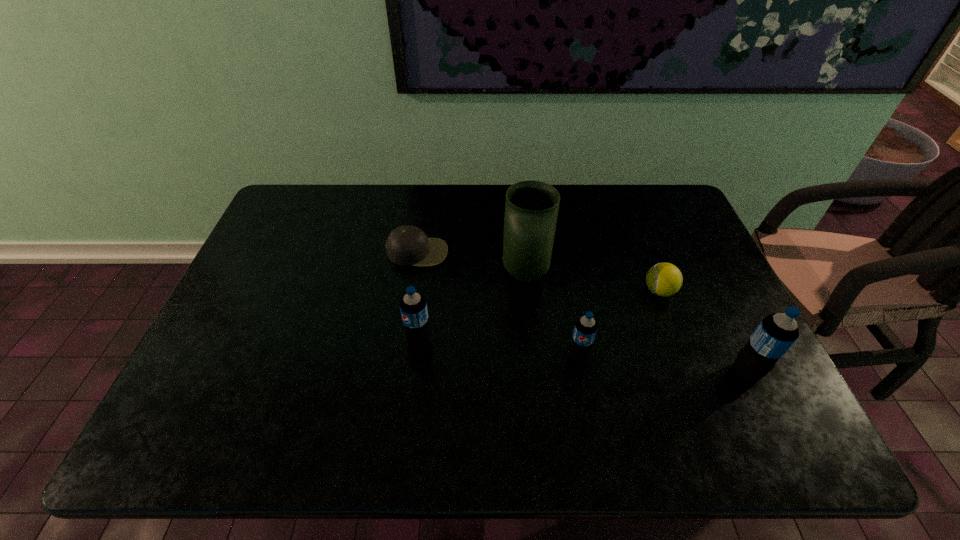
Please show where to add a soda bottle on the left while keeping spacing even. Please provide its 2D coordinates. Your answer should be formatted as a tuple, i.e. [(x, y)], where the tuple contains the x and y coordinates of a point satisfying the conditions above.

[(268, 327)]